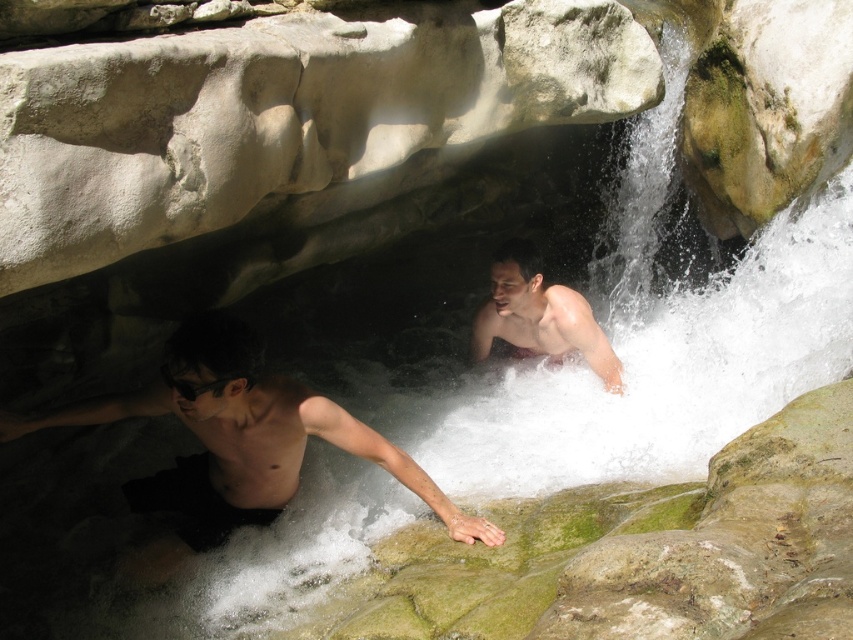
Does dark skin man at left have a larger size compared to smooth skin man at center?

Yes, dark skin man at left is bigger than smooth skin man at center.

Is point (123, 488) farther from camera compared to point (527, 323)?

No, it is not.

I want to click on dark skin man at left, so point(235,444).